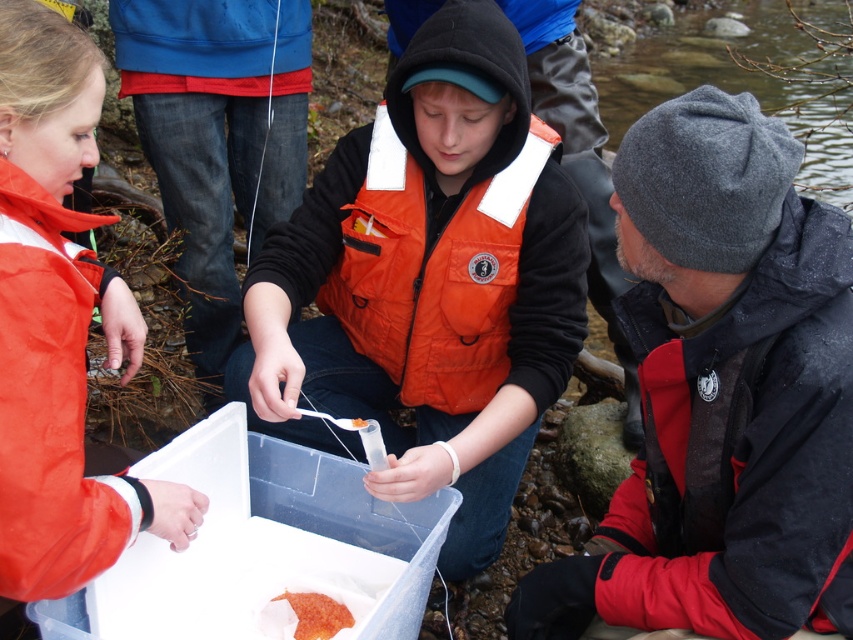
What object is located at the coordinates point (433, 273) in the image?

The point (433, 273) corresponds to the orange quilted life jacket at center.